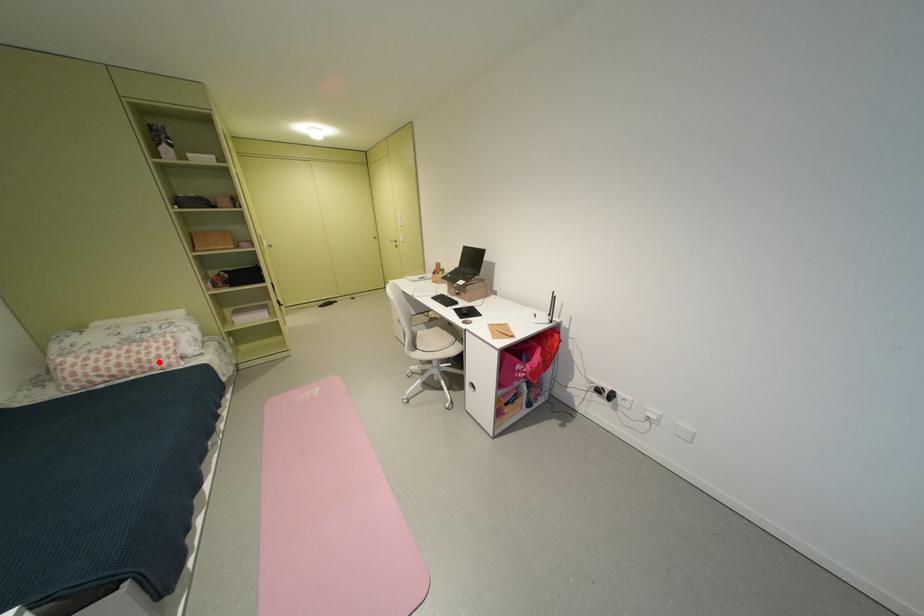
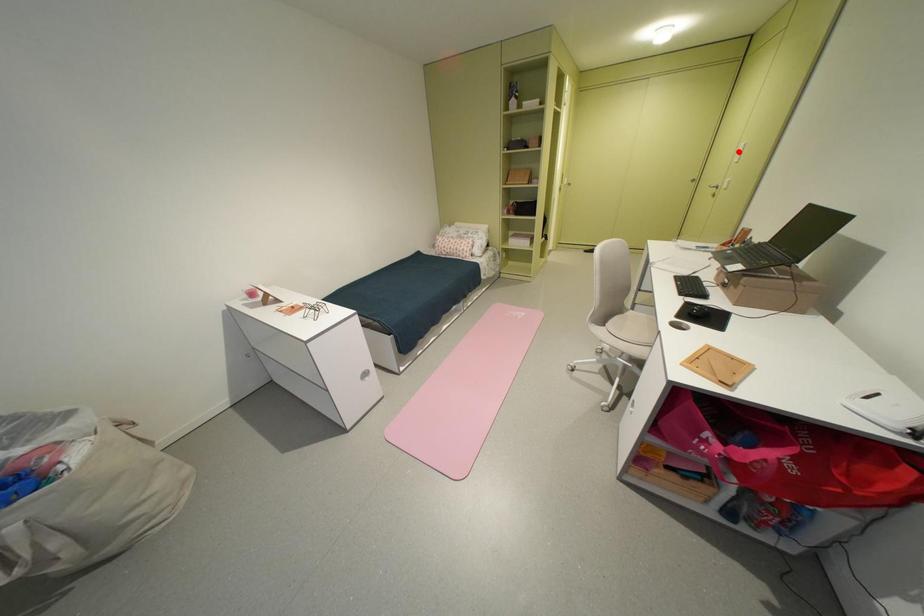
I am providing you with two images of the same scene from different viewpoints. A red point is marked on the first image and another point is marked on the second image. Does the point marked in image1 correspond to the same location as the one in image2?

No